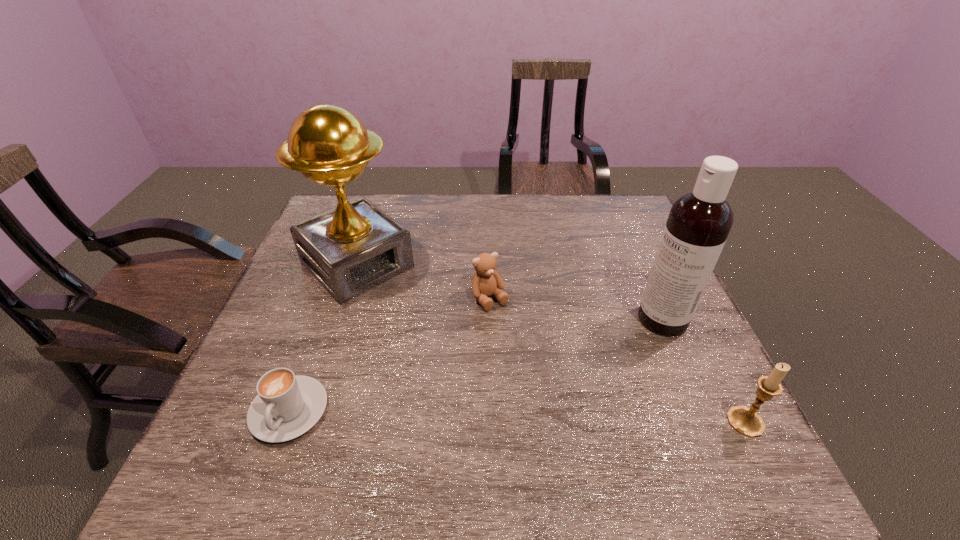
The image size is (960, 540). I want to click on free space on the desktop that is between the shortest object and the candle holder and is positioned on the front-facing side of the award, so click(518, 416).

Find the location of a particular element. This screenshot has height=540, width=960. vacant spot on the desktop that is between the cappuccino and the third shortest object and is positioned on the front-facing side of the teddy bear is located at coordinates (579, 417).

The image size is (960, 540). Identify the location of vacant spot on the desktop that is between the shortest object and the third tallest object and is positioned on the label side of the dishwasher detergent. (476, 415).